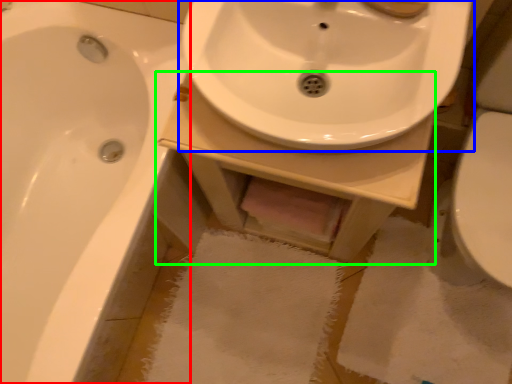
Question: Considering the real-world distances, which object is closest to bathtub (highlighted by a red box)? sink (highlighted by a blue box) or counter top (highlighted by a green box).

Choices:
 (A) sink
 (B) counter top

Answer: (B)